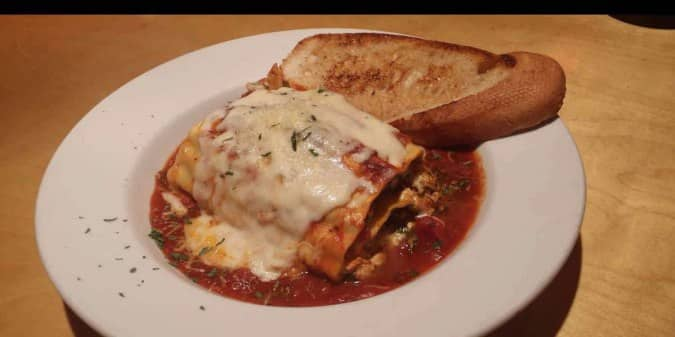
What are the coordinates of `plate shadow on right side` in the screenshot? It's located at (549, 300).